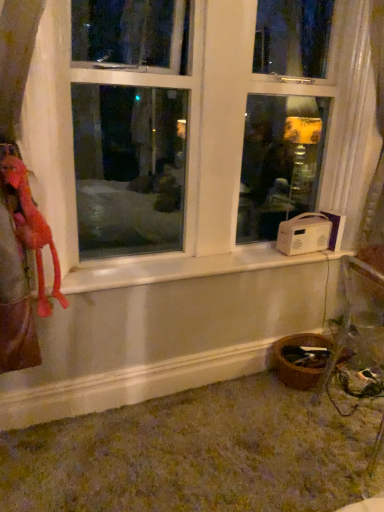
In order to face white plastic window at center, should I rotate leftwards or rightwards?

Rotate right and turn 4.297 degrees.

Find the location of a particular element. The width and height of the screenshot is (384, 512). white plastic window at center is located at coordinates click(200, 145).

Is fluffy pink stuffed animal at left behind white plastic window at center?

Yes, fluffy pink stuffed animal at left is further from the camera.

From a real-world perspective, is fluffy pink stuffed animal at left located beneath white plastic window at center?

Yes.

Which object is positioned more to the left, fluffy pink stuffed animal at left or white plastic window at center?

fluffy pink stuffed animal at left.

At what (x,y) coordinates should I click in order to perform the action: click on animal below the white plastic window at center (from the image's perspective). Please return your answer as a coordinate pair (x, y). This screenshot has width=384, height=512. Looking at the image, I should click on (31, 227).

Between white plastic window at center and white sheer curtain at right, which one appears on the right side from the viewer's perspective?

white sheer curtain at right is more to the right.

How many degrees apart are the facing directions of white plastic window at center and white sheer curtain at right?

Result: The facing directions of white plastic window at center and white sheer curtain at right are 3.02 degrees apart.

Where is `window on the left of white sheer curtain at right`? Image resolution: width=384 pixels, height=512 pixels. window on the left of white sheer curtain at right is located at coordinates (200, 145).

Between white plastic window at center and white sheer curtain at right, which one is positioned in front?

white plastic window at center is more forward.

Consider the image. Is white sheer curtain at right not near white plastic window at center?

They are positioned close to each other.

Image resolution: width=384 pixels, height=512 pixels. I want to click on curtain below the white plastic window at center (from the image's perspective), so click(x=354, y=110).

Measure the distance between white sheer curtain at right and white plastic window at center.

29.18 centimeters.

Does point (21, 203) appear closer or farther from the camera than point (352, 2)?

Point (21, 203).

Based on their sizes in the image, would you say fluffy pink stuffed animal at left is bigger or smaller than white sheer curtain at right?

Clearly, fluffy pink stuffed animal at left is smaller in size than white sheer curtain at right.

Can you confirm if fluffy pink stuffed animal at left is positioned to the right of white sheer curtain at right?

Incorrect, fluffy pink stuffed animal at left is not on the right side of white sheer curtain at right.

From the image's perspective, is fluffy pink stuffed animal at left located above white sheer curtain at right?

Incorrect, from the image's perspective, fluffy pink stuffed animal at left is lower than white sheer curtain at right.

Between white plastic window at center and fluffy pink stuffed animal at left, which one appears on the right side from the viewer's perspective?

white plastic window at center.

Is white plastic window at center thinner than fluffy pink stuffed animal at left?

In fact, white plastic window at center might be wider than fluffy pink stuffed animal at left.

Considering the sizes of white plastic window at center and fluffy pink stuffed animal at left in the image, is white plastic window at center bigger or smaller than fluffy pink stuffed animal at left?

In the image, white plastic window at center appears to be larger than fluffy pink stuffed animal at left.

Which point is more distant from viewer, (212, 52) or (40, 246)?

Positioned behind is point (212, 52).

Is white sheer curtain at right positioned in front of fluffy pink stuffed animal at left?

No.

In terms of height, does white sheer curtain at right look taller or shorter compared to fluffy pink stuffed animal at left?

white sheer curtain at right is taller than fluffy pink stuffed animal at left.

Considering the sizes of white sheer curtain at right and fluffy pink stuffed animal at left in the image, is white sheer curtain at right bigger or smaller than fluffy pink stuffed animal at left?

Considering their sizes, white sheer curtain at right takes up more space than fluffy pink stuffed animal at left.

Is white sheer curtain at right not close to fluffy pink stuffed animal at left?

white sheer curtain at right is positioned a significant distance from fluffy pink stuffed animal at left.

Identify the location of animal that is under the white plastic window at center (from a real-world perspective). (31, 227).

You are a GUI agent. You are given a task and a screenshot of the screen. Output one action in this format:
    pyautogui.click(x=<x>, y=<y>)
    Task: Click on the window on the left of white sheer curtain at right
    Image resolution: width=384 pixels, height=512 pixels.
    Given the screenshot: What is the action you would take?
    pyautogui.click(x=200, y=145)

Based on their spatial positions, is white plastic window at center or fluffy pink stuffed animal at left closer to white sheer curtain at right?

Based on the image, white plastic window at center appears to be nearer to white sheer curtain at right.

From the image, which object appears to be nearer to fluffy pink stuffed animal at left, white sheer curtain at right or white plastic window at center?

The object closer to fluffy pink stuffed animal at left is white plastic window at center.

Looking at the image, which one is located closer to white sheer curtain at right, fluffy pink stuffed animal at left or white plastic window at center?

white plastic window at center is closer to white sheer curtain at right.

Considering their positions, is white sheer curtain at right positioned further to white plastic window at center than fluffy pink stuffed animal at left?

Among the two, fluffy pink stuffed animal at left is located further to white plastic window at center.

Considering their positions, is white plastic window at center positioned closer to fluffy pink stuffed animal at left than white sheer curtain at right?

white plastic window at center.

Estimate the real-world distances between objects in this image. Which object is closer to white plastic window at center, fluffy pink stuffed animal at left or white sheer curtain at right?

Among the two, white sheer curtain at right is located nearer to white plastic window at center.

You are a GUI agent. You are given a task and a screenshot of the screen. Output one action in this format:
    pyautogui.click(x=<x>, y=<y>)
    Task: Click on the window between fluffy pink stuffed animal at left and white sheer curtain at right from left to right
    The width and height of the screenshot is (384, 512).
    Given the screenshot: What is the action you would take?
    pyautogui.click(x=200, y=145)